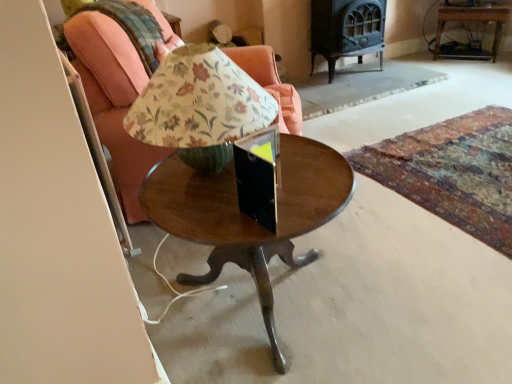
The image size is (512, 384). What do you see at coordinates (248, 217) in the screenshot?
I see `wooden round table at center` at bounding box center [248, 217].

Image resolution: width=512 pixels, height=384 pixels. Describe the element at coordinates (113, 99) in the screenshot. I see `matte wood chair at center` at that location.

Image resolution: width=512 pixels, height=384 pixels. Find the location of `wooden side table at upper right`. wooden side table at upper right is located at coordinates (472, 20).

Is wooden side table at upper right oriented towards matte wood chair at center?

Yes, wooden side table at upper right faces towards matte wood chair at center.

From a real-world perspective, relative to matte wood chair at center, is wooden side table at upper right vertically above or below?

From a real-world perspective, wooden side table at upper right is physically below matte wood chair at center.

From the picture: Can you confirm if wooden side table at upper right is positioned to the left of matte wood chair at center?

Incorrect, wooden side table at upper right is not on the left side of matte wood chair at center.

Considering the points (316, 163) and (122, 69), which point is in front, point (316, 163) or point (122, 69)?

Positioned in front is point (316, 163).

From the image's perspective, is wooden round table at center beneath matte wood chair at center?

Yes, from the image's perspective, wooden round table at center is beneath matte wood chair at center.

Looking at this image, does wooden round table at center lie in front of matte wood chair at center?

That is True.

Does wooden round table at center turn towards matte wood chair at center?

No, wooden round table at center is not aimed at matte wood chair at center.

Is matte wood chair at center facing towards wooden side table at upper right?

No, matte wood chair at center is not aimed at wooden side table at upper right.

Based on their positions, is matte wood chair at center located to the left or right of wooden side table at upper right?

In the image, matte wood chair at center appears on the left side of wooden side table at upper right.

Which object is further away from the camera, matte wood chair at center or wooden side table at upper right?

wooden side table at upper right.

From a real-world perspective, is wooden round table at center positioned above or below wooden side table at upper right?

In terms of real-world spatial position, wooden round table at center is above wooden side table at upper right.

The image size is (512, 384). I want to click on side table behind the wooden round table at center, so click(472, 20).

Choose the correct answer: Is wooden round table at center inside wooden side table at upper right or outside it?

wooden round table at center is spatially situated outside wooden side table at upper right.

Is point (281, 366) closer to camera compared to point (498, 38)?

Yes, point (281, 366) is in front of point (498, 38).

Choose the correct answer: Is wooden side table at upper right inside wooden round table at center or outside it?

wooden side table at upper right is located beyond the bounds of wooden round table at center.

Between wooden side table at upper right and wooden round table at center, which one appears on the right side from the viewer's perspective?

Positioned to the right is wooden side table at upper right.

Is wooden side table at upper right behind wooden round table at center?

That is True.

Could you tell me if matte wood chair at center is turned towards wooden round table at center?

No, matte wood chair at center is not aimed at wooden round table at center.

Can you confirm if matte wood chair at center is positioned to the left of wooden round table at center?

Yes, matte wood chair at center is to the left of wooden round table at center.

From a real-world perspective, relative to wooden round table at center, is matte wood chair at center vertically above or below?

matte wood chair at center is situated higher than wooden round table at center in the real world.

This screenshot has width=512, height=384. What are the coordinates of `chair in front of the wooden side table at upper right` in the screenshot? It's located at (113, 99).

You are a GUI agent. You are given a task and a screenshot of the screen. Output one action in this format:
    pyautogui.click(x=<x>, y=<y>)
    Task: Click on the chair lying above the wooden round table at center (from the image's perspective)
    The width and height of the screenshot is (512, 384).
    Given the screenshot: What is the action you would take?
    pyautogui.click(x=113, y=99)

Estimate the real-world distances between objects in this image. Which object is further from matte wood chair at center, wooden round table at center or wooden side table at upper right?

wooden side table at upper right.

Looking at the image, which one is located closer to wooden side table at upper right, wooden round table at center or matte wood chair at center?

The object closer to wooden side table at upper right is matte wood chair at center.

Which object lies nearer to the anchor point wooden side table at upper right, matte wood chair at center or wooden round table at center?

Among the two, matte wood chair at center is located nearer to wooden side table at upper right.

Looking at the image, which one is located closer to matte wood chair at center, wooden side table at upper right or wooden round table at center?

wooden round table at center is closer to matte wood chair at center.

Which object lies nearer to the anchor point wooden round table at center, wooden side table at upper right or matte wood chair at center?

Among the two, matte wood chair at center is located nearer to wooden round table at center.

Based on the photo, considering their positions, is matte wood chair at center positioned further to wooden round table at center than wooden side table at upper right?

The object further to wooden round table at center is wooden side table at upper right.

This screenshot has height=384, width=512. I want to click on chair between wooden round table at center and wooden side table at upper right in the front-back direction, so click(x=113, y=99).